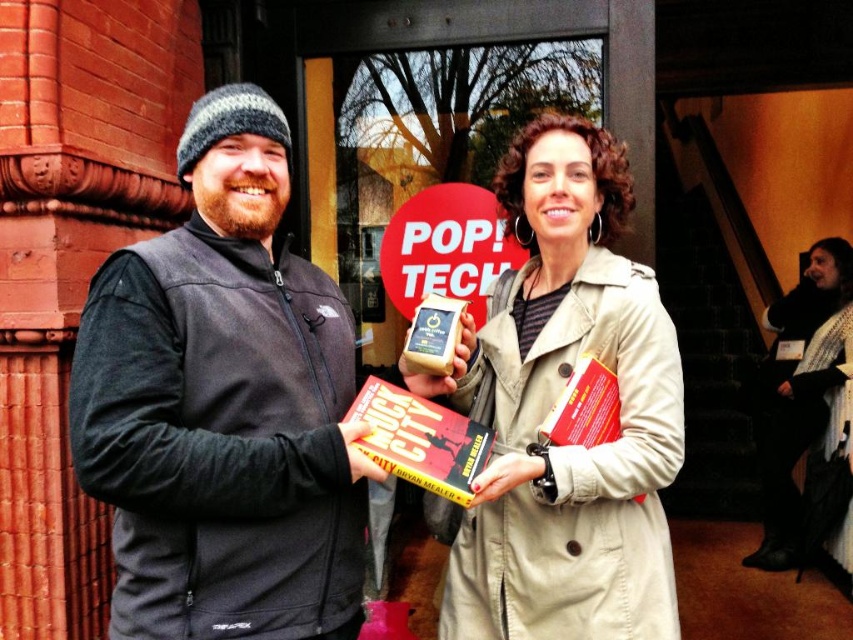
Question: Based on their relative distances, which object is nearer to the beige trench coat at center?

Choices:
 (A) black fleece vest at center
 (B) black knit sweater at lower right

Answer: (A)

Question: Does black fleece vest at center have a smaller size compared to red paper sign at center?

Choices:
 (A) yes
 (B) no

Answer: (B)

Question: Is black knit sweater at lower right bigger than red paper sign at center?

Choices:
 (A) no
 (B) yes

Answer: (B)

Question: Which of the following is the farthest from the observer?

Choices:
 (A) red paper sign at center
 (B) black fleece vest at center
 (C) beige trench coat at center
 (D) black knit sweater at lower right

Answer: (D)

Question: Observing the image, what is the correct spatial positioning of black fleece vest at center in reference to red paper sign at center?

Choices:
 (A) below
 (B) above

Answer: (A)

Question: Which object appears closest to the camera in this image?

Choices:
 (A) black knit sweater at lower right
 (B) beige trench coat at center
 (C) black fleece vest at center

Answer: (C)